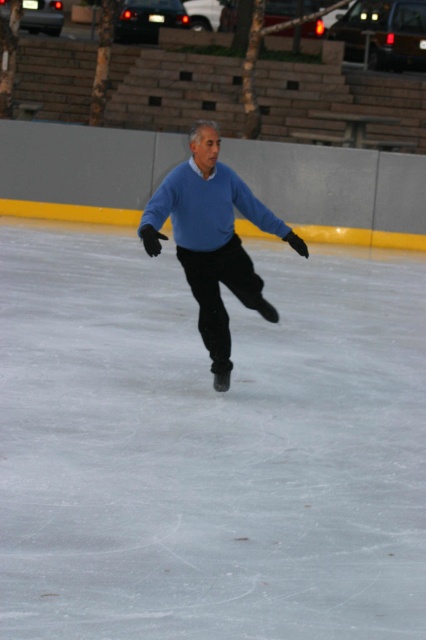
Does white smooth ice at center have a lesser height compared to matte blue sweater at center?

Incorrect, white smooth ice at center's height does not fall short of matte blue sweater at center's.

Which is above, white smooth ice at center or matte blue sweater at center?

matte blue sweater at center is higher up.

You are a GUI agent. You are given a task and a screenshot of the screen. Output one action in this format:
    pyautogui.click(x=<x>, y=<y>)
    Task: Click on the white smooth ice at center
    The image size is (426, 640).
    Given the screenshot: What is the action you would take?
    pyautogui.click(x=209, y=445)

Locate an element on the screen. white smooth ice at center is located at coordinates (209, 445).